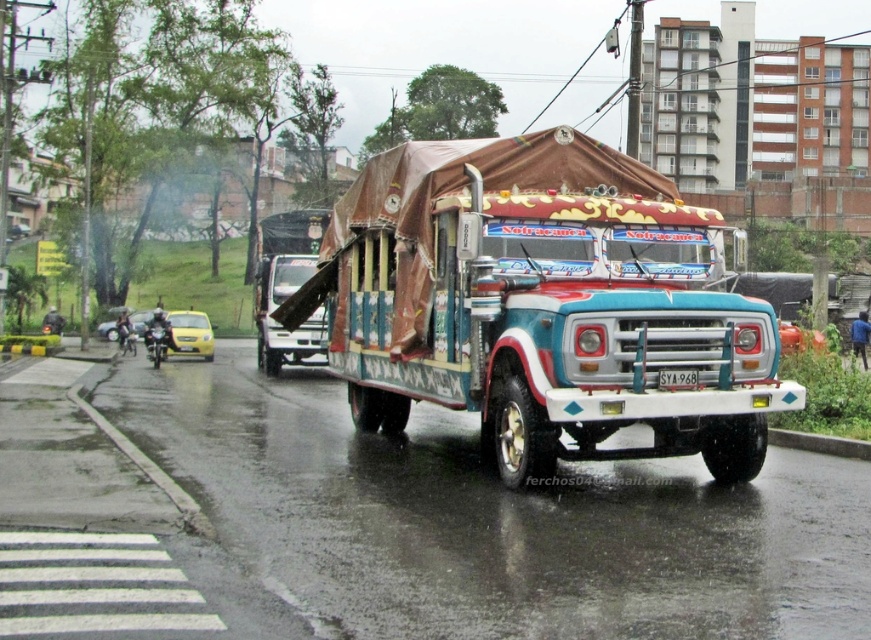
You are standing on the wet road in the Latin American city scene. There is a painted wood truck at center. If you want to approach the truck, how many steps would you need to take to reach it if each of your steps covers approximately 3 feet?

The painted wood truck at center is 27.16 feet away from the viewer. Since each step covers 3 feet, dividing 27.16 by 3 gives approximately 9.05 steps. Therefore, you would need about 9 steps to reach the painted wood truck at center.